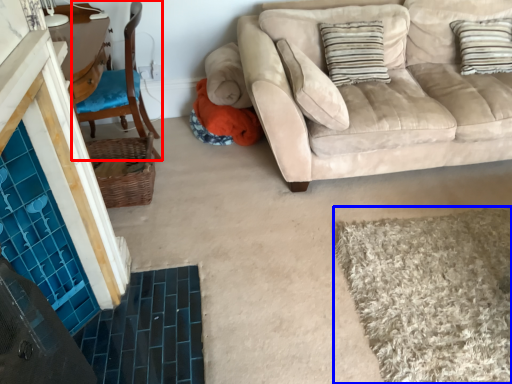
Question: Which point is further to the camera, chair (highlighted by a red box) or bath mat (highlighted by a blue box)?

Choices:
 (A) chair
 (B) bath mat

Answer: (A)